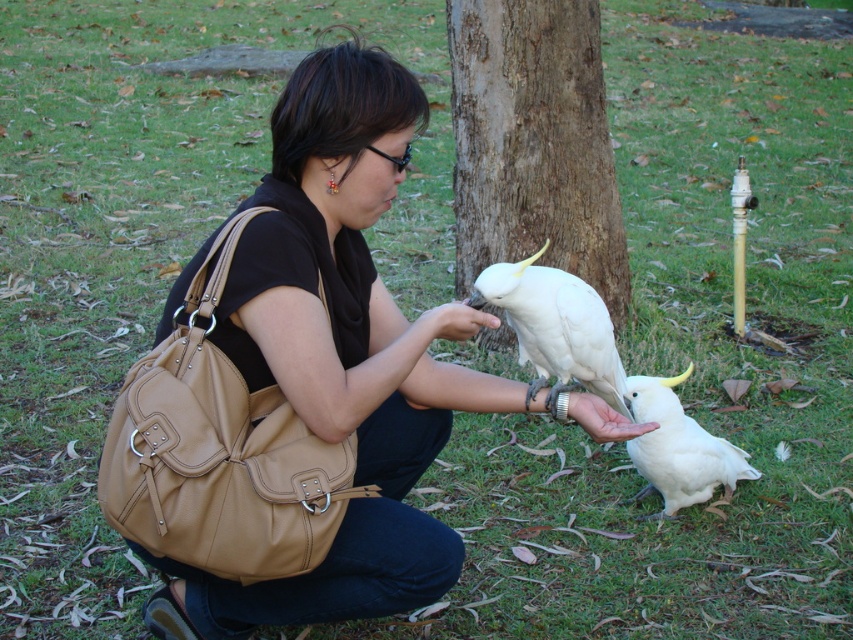
Is brown rough tree trunk at center shorter than white matte parrot at lower right?

No, brown rough tree trunk at center is not shorter than white matte parrot at lower right.

Is point (526, 157) more distant than point (656, 436)?

Yes.

Does point (521, 218) lie in front of point (679, 426)?

No, (521, 218) is further to viewer.

The height and width of the screenshot is (640, 853). I want to click on brown rough tree trunk at center, so pyautogui.click(x=532, y=141).

This screenshot has height=640, width=853. Describe the element at coordinates (339, 353) in the screenshot. I see `matte brown bag at center` at that location.

Between point (349, 339) and point (650, 438), which one is positioned behind?

The point (650, 438) is behind.

Is point (318, 342) closer to camera compared to point (737, 474)?

Yes, point (318, 342) is closer to viewer.

The width and height of the screenshot is (853, 640). What are the coordinates of `matte brown bag at center` in the screenshot? It's located at (339, 353).

Which is behind, point (415, 474) or point (520, 296)?

Positioned behind is point (520, 296).

What are the coordinates of `matte brown bag at center` in the screenshot? It's located at (339, 353).